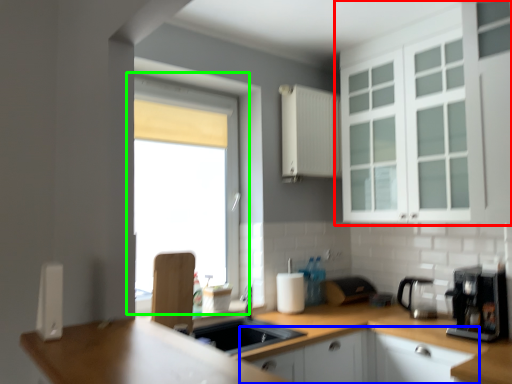
Question: Considering the real-world distances, which object is farthest from cabinetry (highlighted by a red box)? cabinetry (highlighted by a blue box) or window (highlighted by a green box)?

Choices:
 (A) cabinetry
 (B) window

Answer: (B)